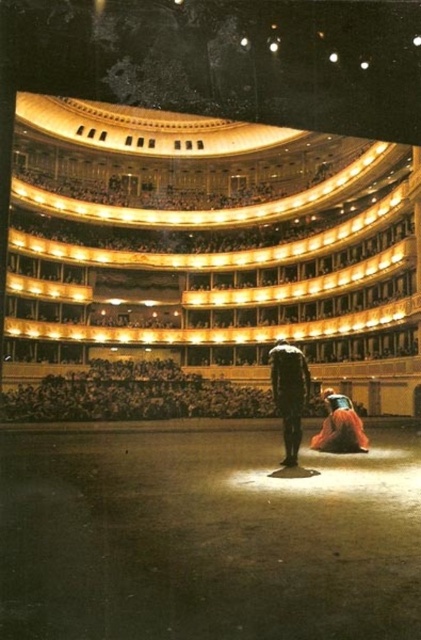
Question: Which of the following is the farthest from the observer?

Choices:
 (A) black matte suit at center
 (B) velvet orange dress at lower right

Answer: (B)

Question: Which point is closer to the camera?

Choices:
 (A) black matte suit at center
 (B) velvet orange dress at lower right

Answer: (A)

Question: Does black matte suit at center appear over velvet orange dress at lower right?

Choices:
 (A) yes
 (B) no

Answer: (A)

Question: Does black matte suit at center appear on the left side of velvet orange dress at lower right?

Choices:
 (A) no
 (B) yes

Answer: (B)

Question: Is the position of black matte suit at center more distant than that of velvet orange dress at lower right?

Choices:
 (A) no
 (B) yes

Answer: (A)